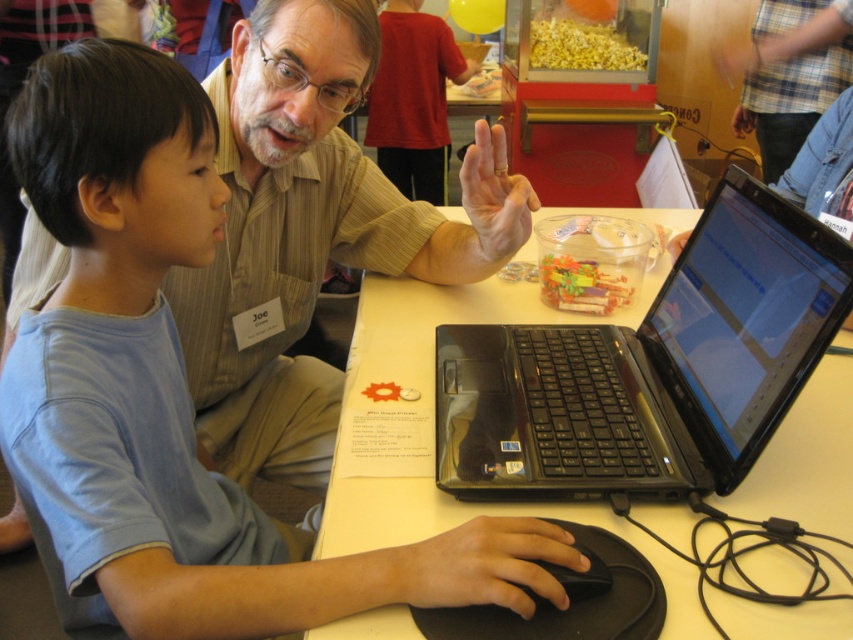
Can you confirm if light blue cotton shirt at center is shorter than white glossy table at center?

No.

Is the position of light blue cotton shirt at center less distant than that of white glossy table at center?

Yes, light blue cotton shirt at center is in front of white glossy table at center.

Locate an element on the screen. The height and width of the screenshot is (640, 853). light blue cotton shirt at center is located at coordinates (181, 384).

Does light blue cotton shirt at center appear on the left side of black matte mouse at lower center?

Correct, you'll find light blue cotton shirt at center to the left of black matte mouse at lower center.

Between light blue cotton shirt at center and black matte mouse at lower center, which one is positioned higher?

light blue cotton shirt at center is higher up.

This screenshot has width=853, height=640. What do you see at coordinates (181, 384) in the screenshot?
I see `light blue cotton shirt at center` at bounding box center [181, 384].

This screenshot has height=640, width=853. What are the coordinates of `light blue cotton shirt at center` in the screenshot? It's located at (181, 384).

Does light blue cotton shirt at center come behind black plastic laptop at center?

No, it is not.

You are a GUI agent. You are given a task and a screenshot of the screen. Output one action in this format:
    pyautogui.click(x=<x>, y=<y>)
    Task: Click on the light blue cotton shirt at center
    The width and height of the screenshot is (853, 640).
    Given the screenshot: What is the action you would take?
    pyautogui.click(x=181, y=384)